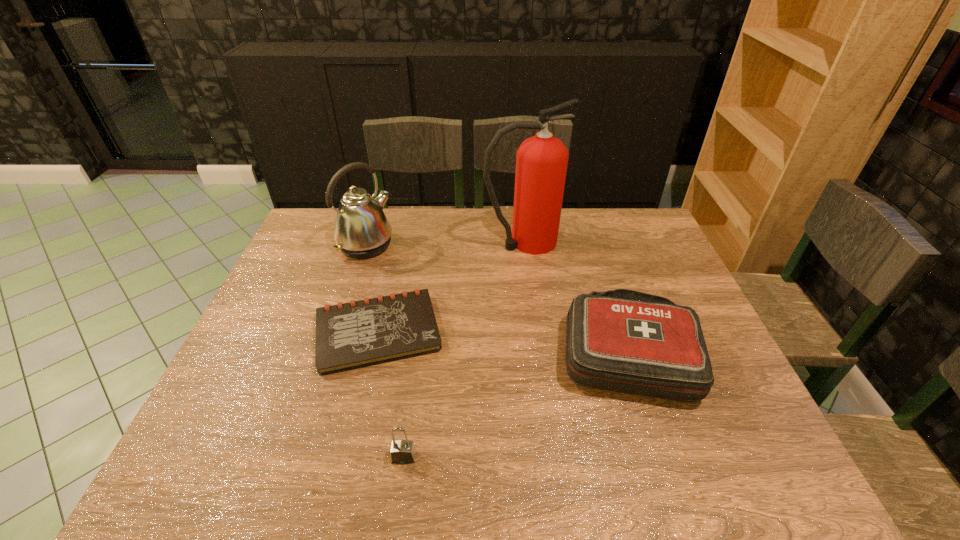
Where is `vacant space at the far right corner of the desktop`? vacant space at the far right corner of the desktop is located at coordinates coord(634,221).

In the image, there is a desktop. Where is `vacant area at the near right corner`? vacant area at the near right corner is located at coordinates (747, 454).

Identify the location of empty space between the tallest object and the first-aid kit. The image size is (960, 540). (577, 297).

At what (x,y) coordinates should I click in order to perform the action: click on vacant area that lies between the padlock and the first-aid kit. Please return your answer as a coordinate pair (x, y). This screenshot has width=960, height=540. Looking at the image, I should click on (517, 404).

Identify the location of vacant point located between the fire extinguisher and the shortest object. This screenshot has width=960, height=540. (450, 287).

Where is `empty space that is in between the tallest object and the padlock`? This screenshot has height=540, width=960. empty space that is in between the tallest object and the padlock is located at coordinates (464, 350).

You are a GUI agent. You are given a task and a screenshot of the screen. Output one action in this format:
    pyautogui.click(x=<x>, y=<y>)
    Task: Click on the empty location between the shortest object and the padlock
    The image size is (960, 540).
    Given the screenshot: What is the action you would take?
    pyautogui.click(x=391, y=395)

Image resolution: width=960 pixels, height=540 pixels. I want to click on unoccupied area between the fire extinguisher and the nearest object, so click(x=464, y=350).

Identify the location of free point between the fourth shortest object and the fire extinguisher. The image size is (960, 540). (444, 244).

Image resolution: width=960 pixels, height=540 pixels. I want to click on empty location between the notebook and the nearest object, so click(391, 395).